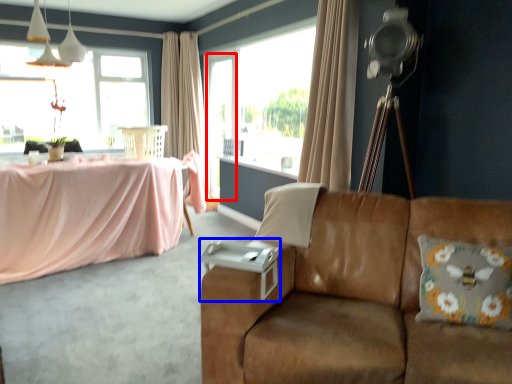
Question: Which of the following is the closest to the observer, screen door (highlighted by a red box) or side table (highlighted by a blue box)?

Choices:
 (A) screen door
 (B) side table

Answer: (B)